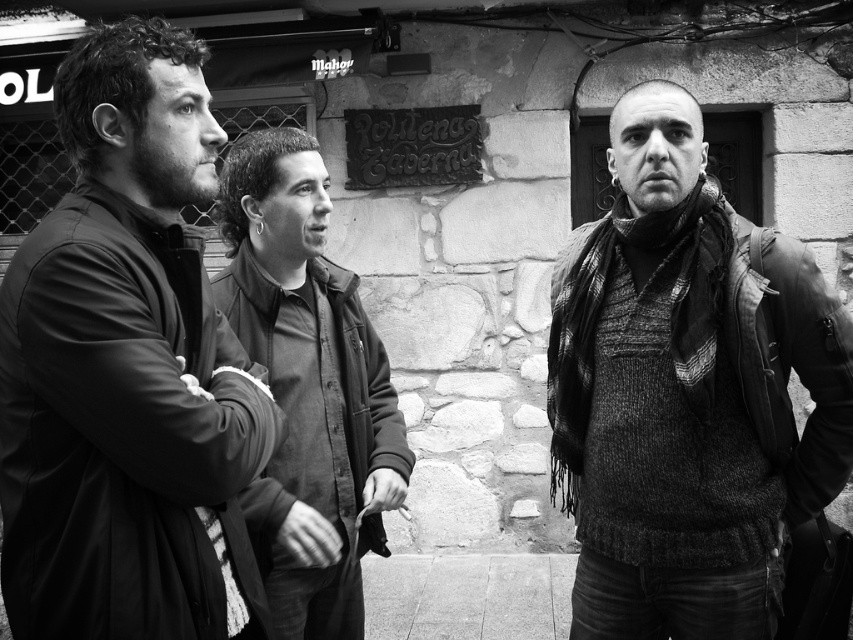
Which is behind, point (577, 410) or point (335, 438)?

The point (335, 438) is behind.

Measure the distance from knitted sweater at right to dark gray jacket at center.

A distance of 34.58 inches exists between knitted sweater at right and dark gray jacket at center.

Locate an element on the screen. knitted sweater at right is located at coordinates (688, 392).

Find the location of a particular element. Image resolution: width=853 pixels, height=640 pixels. knitted sweater at right is located at coordinates (688, 392).

Who is positioned more to the right, matte black jacket at left or dark gray jacket at center?

Positioned to the right is dark gray jacket at center.

In the scene shown: Is matte black jacket at left thinner than dark gray jacket at center?

Indeed, matte black jacket at left has a lesser width compared to dark gray jacket at center.

Locate an element on the screen. matte black jacket at left is located at coordinates (126, 371).

Measure the distance between point (x=218, y=540) and camera.

2.28 meters

This screenshot has height=640, width=853. Find the location of `matte black jacket at left`. matte black jacket at left is located at coordinates (126, 371).

You are a GUI agent. You are given a task and a screenshot of the screen. Output one action in this format:
    pyautogui.click(x=<x>, y=<y>)
    Task: Click on the matte black jacket at left
    This screenshot has width=853, height=640.
    Given the screenshot: What is the action you would take?
    pyautogui.click(x=126, y=371)